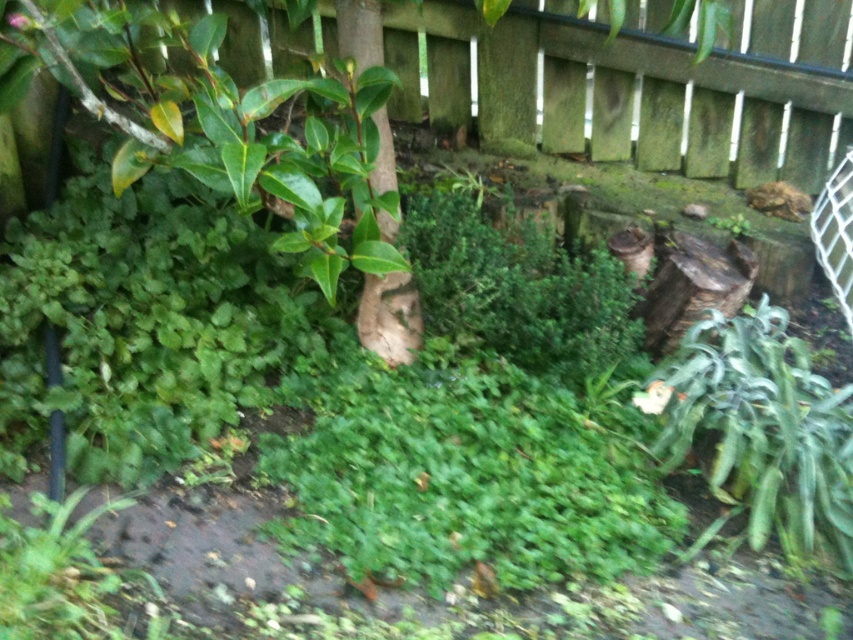
Question: Can you confirm if green leafy bush at center is positioned to the right of brown rough tree trunk at center?

Choices:
 (A) no
 (B) yes

Answer: (B)

Question: Does green leafy bush at center lie behind brown rough tree trunk at center?

Choices:
 (A) yes
 (B) no

Answer: (A)

Question: Can you confirm if green leafy bush at center is smaller than brown rough tree trunk at center?

Choices:
 (A) yes
 (B) no

Answer: (B)

Question: Which of the following is the farthest from the observer?

Choices:
 (A) (380, 211)
 (B) (344, 108)

Answer: (B)

Question: Among these objects, which one is farthest from the camera?

Choices:
 (A) green leafy bush at center
 (B) green leafy grass at center
 (C) green glossy leaves at upper left
 (D) brown rough tree trunk at center

Answer: (A)

Question: Among these objects, which one is nearest to the camera?

Choices:
 (A) brown rough tree trunk at center
 (B) green leafy bush at center
 (C) green glossy leaves at upper left
 (D) green leafy grass at center

Answer: (C)